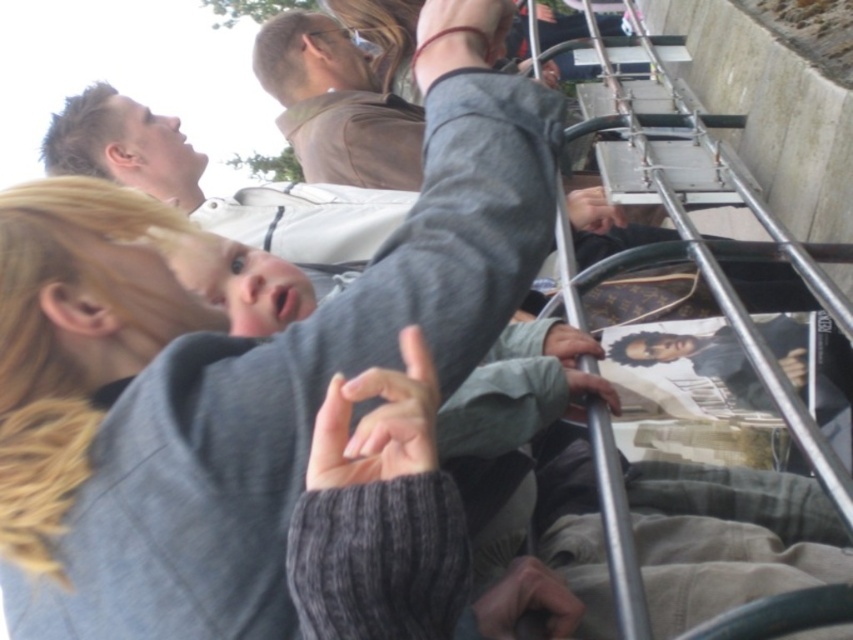
Between gray fabric jacket at upper center and matte gray wristband at upper center, which one appears on the left side from the viewer's perspective?

From the viewer's perspective, gray fabric jacket at upper center appears more on the left side.

Which is below, gray fabric jacket at upper center or matte gray wristband at upper center?

gray fabric jacket at upper center is below.

Locate an element on the screen. This screenshot has height=640, width=853. gray fabric jacket at upper center is located at coordinates (230, 380).

Measure the distance between gray fabric jacket at upper center and gray knitted sweater at center.

gray fabric jacket at upper center is 32.32 centimeters from gray knitted sweater at center.

Does gray fabric jacket at upper center have a lesser height compared to gray knitted sweater at center?

In fact, gray fabric jacket at upper center may be taller than gray knitted sweater at center.

I want to click on gray fabric jacket at upper center, so click(230, 380).

Does matte gray wristband at upper center have a lesser height compared to matte gray hand at upper center?

Incorrect, matte gray wristband at upper center's height does not fall short of matte gray hand at upper center's.

From the picture: Who is taller, matte gray wristband at upper center or matte gray hand at upper center?

Standing taller between the two is matte gray wristband at upper center.

Find the location of a particular element. The image size is (853, 640). matte gray wristband at upper center is located at coordinates (457, 36).

The width and height of the screenshot is (853, 640). What are the coordinates of `matte gray wristband at upper center` in the screenshot? It's located at (457, 36).